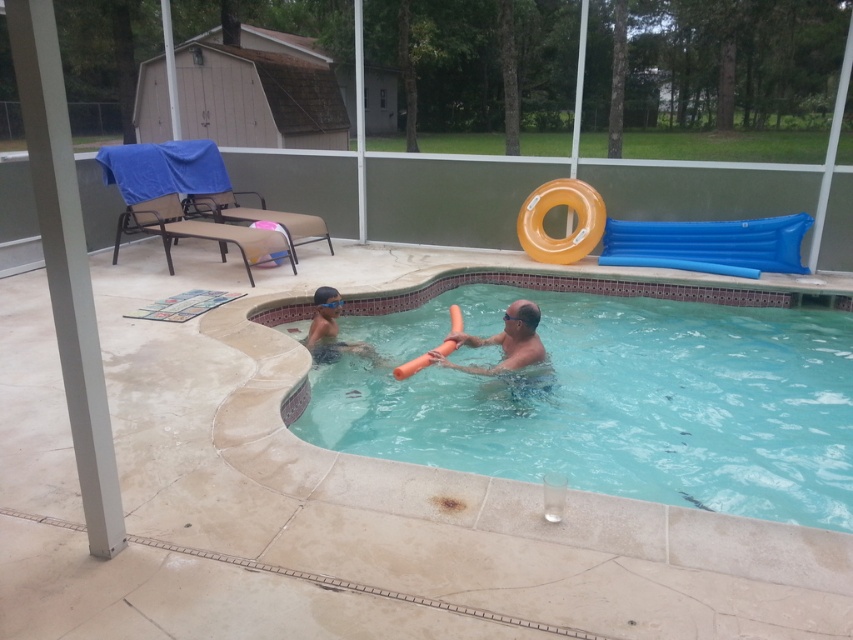
Question: Which is nearer to the clear plastic pool at center?

Choices:
 (A) light blue swim cap at upper center
 (B) orange foam float at center

Answer: (B)

Question: Which of the following is the farthest from the observer?

Choices:
 (A) orange foam float at center
 (B) light blue swim cap at upper center
 (C) clear plastic pool at center

Answer: (B)

Question: Is clear plastic pool at center bigger than orange foam float at center?

Choices:
 (A) yes
 (B) no

Answer: (A)

Question: Does clear plastic pool at center come behind light blue swim cap at upper center?

Choices:
 (A) no
 (B) yes

Answer: (A)

Question: Can you confirm if clear plastic pool at center is positioned above orange foam float at center?

Choices:
 (A) yes
 (B) no

Answer: (B)

Question: Which point is closer to the camera?

Choices:
 (A) orange foam float at center
 (B) light blue swim cap at upper center
 (C) clear plastic pool at center

Answer: (C)